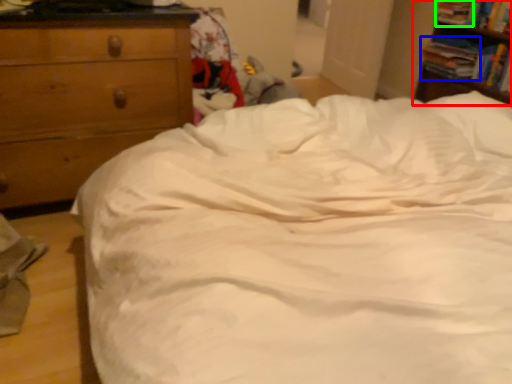
Question: Which is nearer to the nightstand (highlighted by a red box)? book (highlighted by a blue box) or book (highlighted by a green box).

Choices:
 (A) book
 (B) book

Answer: (A)